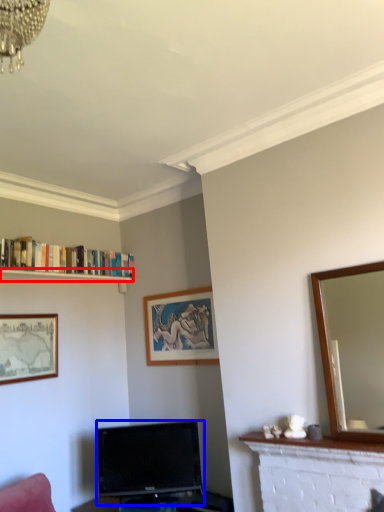
Question: Which object is further to the camera taking this photo, shelf (highlighted by a red box) or television (highlighted by a blue box)?

Choices:
 (A) shelf
 (B) television

Answer: (A)